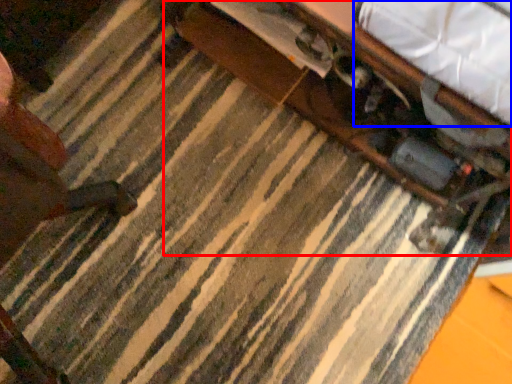
Question: Which object appears closest to the camera in this image, table (highlighted by a red box) or sheet (highlighted by a blue box)?

Choices:
 (A) table
 (B) sheet

Answer: (B)